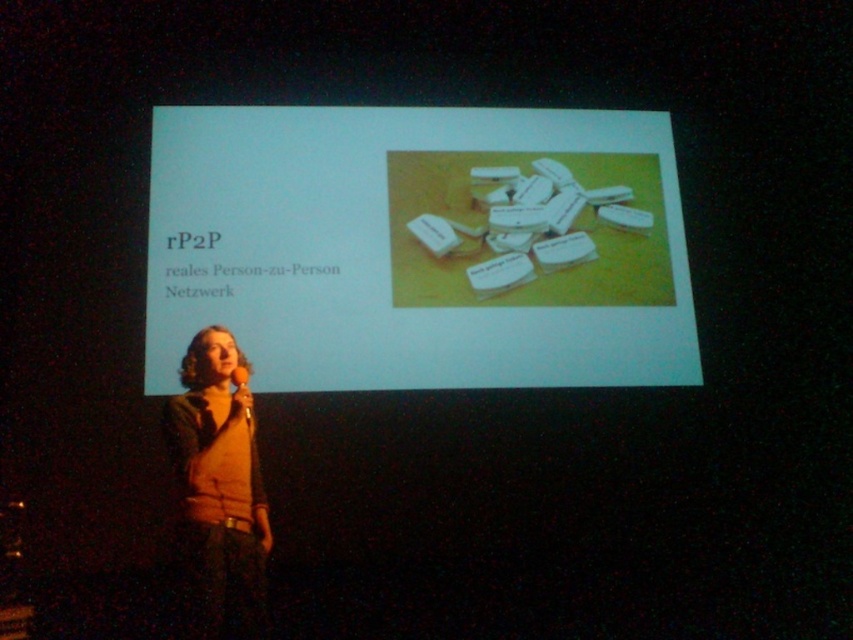
You are an attendee at the presentation and notice two items on the stage. The white paper at upper center and the matte orange sweater at center. Which item is located higher up?

The white paper at upper center is positioned over the matte orange sweater at center, so it is higher up.